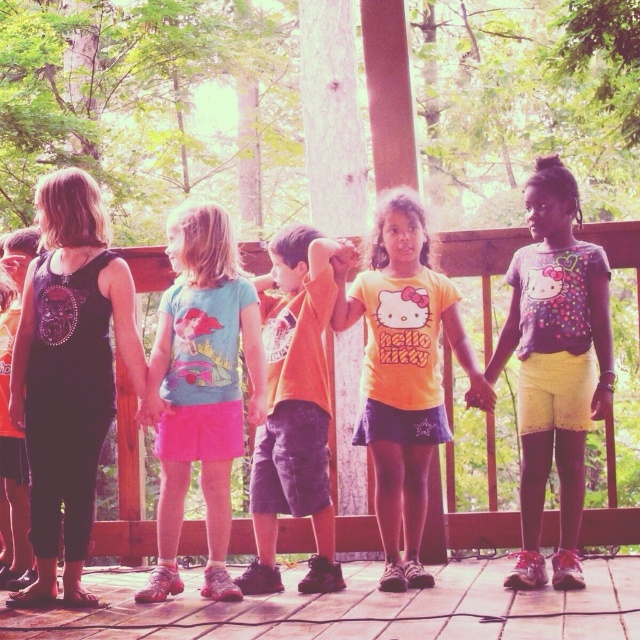
In the scene shown: You are a photographer trying to capture a photo of the brown wooden deck at lower center and the matte pink skirt at center. You need to position yourself so that both subjects are in the frame without any overlap. Given that your camera has a maximum focal length that allows capturing objects up to 12 feet apart, can you successfully take the photo?

The brown wooden deck at lower center and the matte pink skirt at center are 10.66 feet apart from each other. Since this distance is within the camera maximum focal length of 12 feet, you can successfully take the photo without overlap.

You are a photographer trying to capture a photo of the brown wooden deck at lower center and the matte pink skirt at center. Based on their positions, which object should you focus on first if you want to include both in your shot without moving the camera?

The brown wooden deck at lower center is positioned on the right side of the matte pink skirt at center, so you should focus on the matte pink skirt at center first to ensure both are in frame without moving the camera.